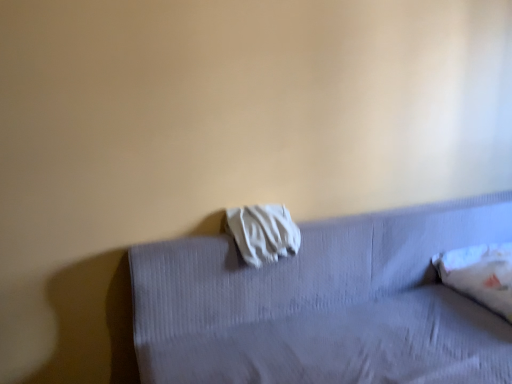
Measure the distance between point (238,213) and camera.

Point (238,213) is 1.61 meters from camera.

At what (x,y) coordinates should I click in order to perform the action: click on white fabric at upper center. Please return your answer as a coordinate pair (x, y). The image size is (512, 384). Looking at the image, I should click on (324, 304).

Image resolution: width=512 pixels, height=384 pixels. What do you see at coordinates (480, 274) in the screenshot? I see `white soft pillow at right` at bounding box center [480, 274].

Locate an element on the screen. The width and height of the screenshot is (512, 384). white fabric at center is located at coordinates (263, 233).

Is white soft pillow at right in contact with white fabric at upper center?

No, white soft pillow at right is not with white fabric at upper center.

From the image's perspective, is white soft pillow at right located above or below white fabric at upper center?

white soft pillow at right is situated higher than white fabric at upper center in the image.

Is white soft pillow at right oriented towards white fabric at upper center?

Yes, white soft pillow at right faces towards white fabric at upper center.

Looking at their sizes, would you say white soft pillow at right is wider or thinner than white fabric at upper center?

Considering their sizes, white soft pillow at right looks slimmer than white fabric at upper center.

Which is farther from the camera, (x=502, y=297) or (x=279, y=238)?

The point (x=502, y=297) is more distant.

Between white soft pillow at right and white fabric at center, which one appears on the left side from the viewer's perspective?

Positioned to the left is white fabric at center.

You are a GUI agent. You are given a task and a screenshot of the screen. Output one action in this format:
    pyautogui.click(x=<x>, y=<y>)
    Task: Click on the material that is on the left side of white soft pillow at right
    
    Given the screenshot: What is the action you would take?
    pyautogui.click(x=263, y=233)

From the image's perspective, relative to white soft pillow at right, is white fabric at upper center above or below?

From the image's perspective, white fabric at upper center appears below white soft pillow at right.

Considering the points (352, 290) and (499, 261), which point is in front, point (352, 290) or point (499, 261)?

Positioned in front is point (499, 261).

From a real-world perspective, which object rests below the other?

white fabric at upper center, from a real-world perspective.

Based on the photo, which object is positioned more to the right, white fabric at upper center or white soft pillow at right?

From the viewer's perspective, white soft pillow at right appears more on the right side.

Does white fabric at center have a lesser height compared to white fabric at upper center?

Yes.

Is white fabric at center surrounding white fabric at upper center?

Definitely not — white fabric at upper center is not inside white fabric at center.

From the image's perspective, which one is positioned higher, white fabric at center or white fabric at upper center?

white fabric at center is shown above in the image.

Considering the positions of objects white fabric at center and white fabric at upper center in the image provided, who is more to the left, white fabric at center or white fabric at upper center?

Positioned to the left is white fabric at center.

Considering the relative sizes of white fabric at center and white soft pillow at right in the image provided, is white fabric at center bigger than white soft pillow at right?

Incorrect, white fabric at center is not larger than white soft pillow at right.

Which object is closer to the camera, white fabric at center or white soft pillow at right?

white fabric at center is closer to the camera.

Is white fabric at center wider or thinner than white soft pillow at right?

In the image, white fabric at center appears to be more narrow than white soft pillow at right.

Is white fabric at center aimed at white soft pillow at right?

No, white fabric at center is not oriented towards white soft pillow at right.

Considering the sizes of objects white fabric at upper center and white fabric at center in the image provided, who is thinner, white fabric at upper center or white fabric at center?

With smaller width is white fabric at center.

Is white fabric at upper center facing away from white fabric at center?

Yes, white fabric at upper center's orientation is away from white fabric at center.

How much distance is there between white fabric at upper center and white fabric at center?

white fabric at upper center and white fabric at center are 12.15 inches apart from each other.

Is white fabric at upper center touching white fabric at center?

No, white fabric at upper center is not beside white fabric at center.

Find the location of `pillow behind the white fabric at upper center`. pillow behind the white fabric at upper center is located at coordinates (480, 274).

Image resolution: width=512 pixels, height=384 pixels. I want to click on pillow that is below the white fabric at center (from the image's perspective), so click(480, 274).

Estimate the real-world distances between objects in this image. Which object is further from white fabric at upper center, white fabric at center or white soft pillow at right?

white soft pillow at right is further to white fabric at upper center.

Which object lies further to the anchor point white soft pillow at right, white fabric at upper center or white fabric at center?

white fabric at center.

From the image, which object appears to be nearer to white fabric at center, white fabric at upper center or white soft pillow at right?

The object closer to white fabric at center is white fabric at upper center.

Considering their positions, is white soft pillow at right positioned closer to white fabric at upper center than white fabric at center?

white fabric at center is closer to white fabric at upper center.

Estimate the real-world distances between objects in this image. Which object is further from white soft pillow at right, white fabric at center or white fabric at upper center?

white fabric at center is positioned further to the anchor white soft pillow at right.

Estimate the real-world distances between objects in this image. Which object is closer to white fabric at center, white soft pillow at right or white fabric at upper center?

white fabric at upper center.

At what (x,y) coordinates should I click in order to perform the action: click on furniture between white fabric at center and white soft pillow at right from left to right. Please return your answer as a coordinate pair (x, y). The image size is (512, 384). Looking at the image, I should click on (324, 304).